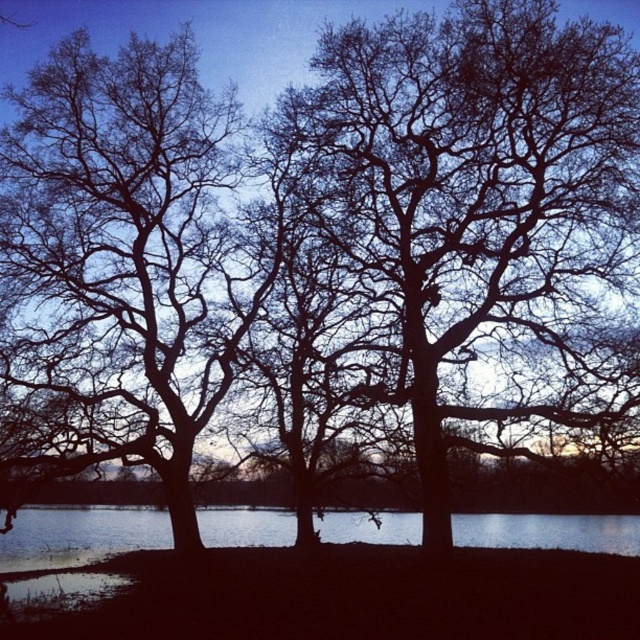
You are standing in the twilight landscape and want to walk from the point closer to you to the point further away. Which path should you take between the two points, point (128, 292) and point (68, 544)?

You should walk from point (128, 292) to point (68, 544) because point (128, 292) is closer to you and point (68, 544) is further away, so this path goes away from you.